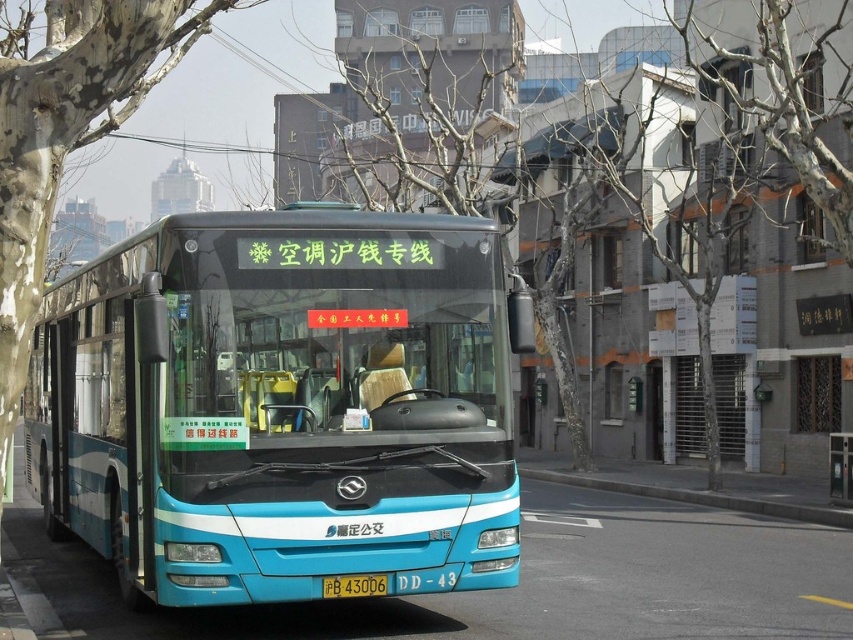
Please describe the object located at point coordinates (735,365) in the image.

The point at coordinates (735,365) corresponds to a wooden signboard at right.

In the scene shown: You are a pedestrian standing in front of the blue public bus. You see a smooth bark tree at left and a wooden signboard at right. Which object is higher from the ground?

The smooth bark tree at left is above the wooden signboard at right, so the smooth bark tree at left is higher from the ground.

You are a delivery person with a cart that is 1.5 meters wide. You need to move your cart from the wooden signboard at right to the gray concrete curb at lower center. Is there enough space for your cart to pass between them?

The distance between the wooden signboard at right and the gray concrete curb at lower center is 4.54 meters. Since your cart is 1.5 meters wide, there is sufficient space for it to pass between them as the distance is greater than the cart width.